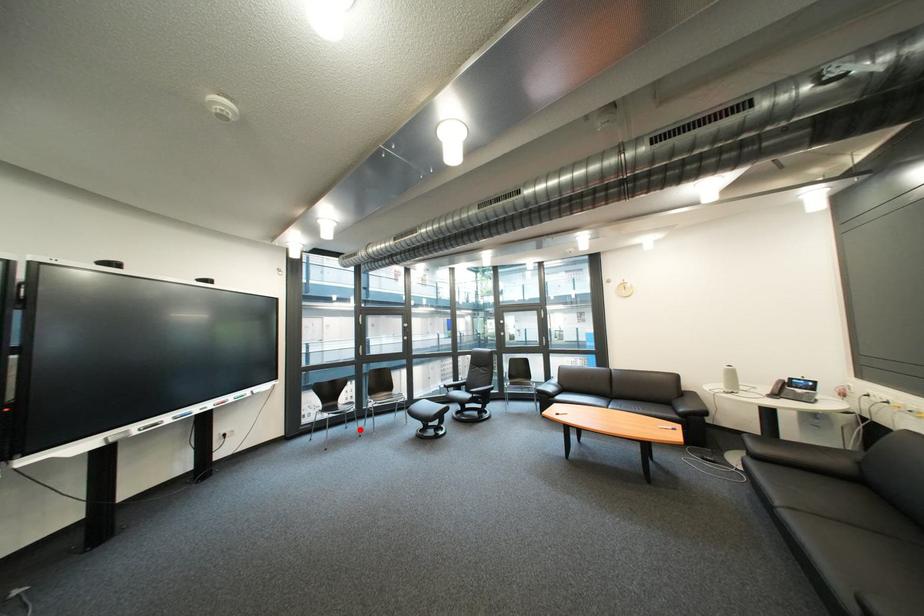
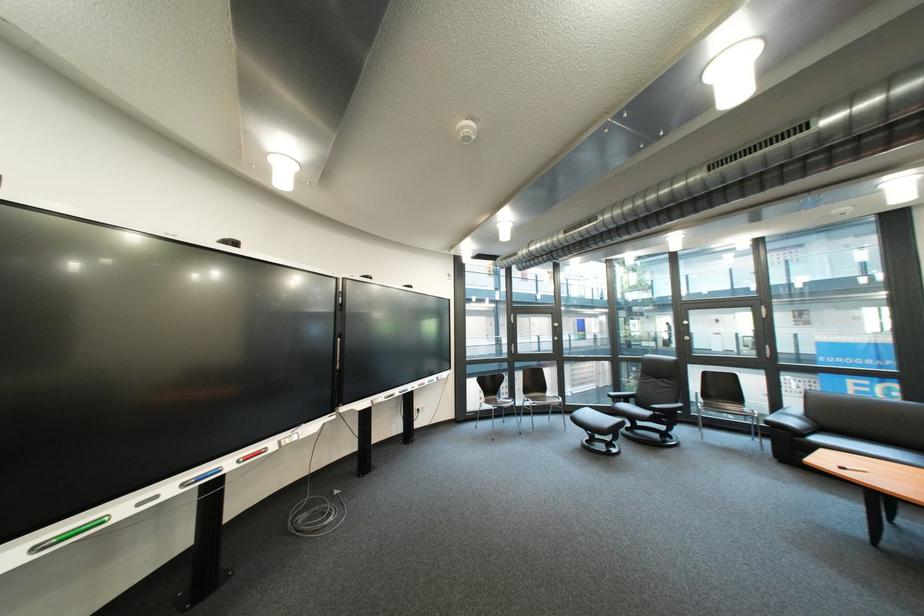
The point at the highlighted location is marked in the first image. Where is the corresponding point in the second image?

(517, 424)